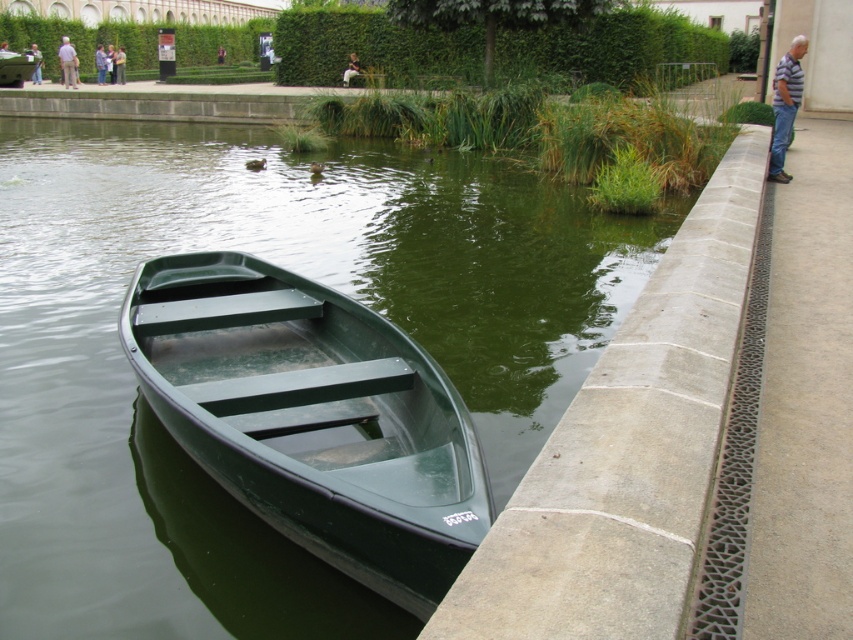
Measure the distance from green plastic boat at lower left to striped shirt at right.

green plastic boat at lower left is 8.70 meters from striped shirt at right.

Does green plastic boat at lower left have a greater height compared to striped shirt at right?

Yes.

Which is behind, point (57, 259) or point (770, 156)?

Point (770, 156)

Where is `green plastic boat at lower left`? green plastic boat at lower left is located at coordinates (293, 269).

Is green plastic canoe at center smaller than gray fabric jacket at upper left?

Yes, green plastic canoe at center is smaller than gray fabric jacket at upper left.

Measure the distance between green plastic canoe at center and gray fabric jacket at upper left.

A distance of 32.88 meters exists between green plastic canoe at center and gray fabric jacket at upper left.

Identify the location of green plastic canoe at center. (312, 417).

Can you confirm if green plastic canoe at center is smaller than light blue shirt at upper left?

Correct, green plastic canoe at center occupies less space than light blue shirt at upper left.

Can you confirm if green plastic canoe at center is shorter than light blue shirt at upper left?

Correct, green plastic canoe at center is not as tall as light blue shirt at upper left.

Between point (149, 376) and point (103, 65), which one is positioned behind?

Point (103, 65)

The width and height of the screenshot is (853, 640). I want to click on green plastic canoe at center, so click(x=312, y=417).